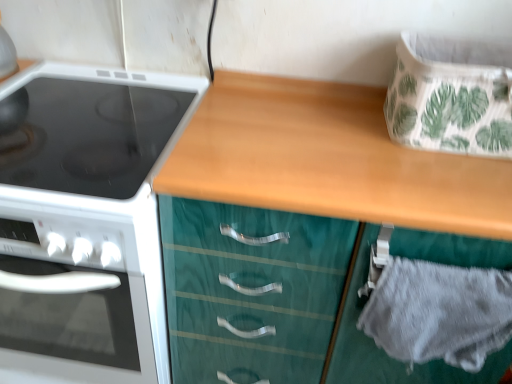
Question: From a real-world perspective, is white glossy electric stove at left on top of gray fabric drawer at lower right, the 1th cabinetry from the back?

Choices:
 (A) yes
 (B) no

Answer: (B)

Question: Is there a large distance between white glossy electric stove at left and gray fabric drawer at lower right, which ranks as the 2th cabinetry in front-to-back order?

Choices:
 (A) no
 (B) yes

Answer: (A)

Question: Can you confirm if white glossy electric stove at left is taller than gray fabric drawer at lower right, the 1th cabinetry from the back?

Choices:
 (A) no
 (B) yes

Answer: (B)

Question: Considering the relative sizes of white glossy electric stove at left and gray fabric drawer at lower right, the 1th cabinetry from the back, in the image provided, is white glossy electric stove at left thinner than gray fabric drawer at lower right, the 1th cabinetry from the back,?

Choices:
 (A) yes
 (B) no

Answer: (B)

Question: Could you tell me if white glossy electric stove at left is facing gray fabric drawer at lower right, which ranks as the 2th cabinetry in front-to-back order?

Choices:
 (A) no
 (B) yes

Answer: (A)

Question: Does white glossy electric stove at left lie in front of gray fabric drawer at lower right, the 1th cabinetry from the back?

Choices:
 (A) yes
 (B) no

Answer: (B)

Question: Does white glossy electric stove at left appear on the left side of teal wood cabinet at center, the 1th cabinetry in the front-to-back sequence?

Choices:
 (A) no
 (B) yes

Answer: (B)

Question: Is there a large distance between white glossy electric stove at left and teal wood cabinet at center, the 1th cabinetry in the front-to-back sequence?

Choices:
 (A) yes
 (B) no

Answer: (B)

Question: Is white glossy electric stove at left facing towards teal wood cabinet at center, the 1th cabinetry in the front-to-back sequence?

Choices:
 (A) yes
 (B) no

Answer: (B)

Question: Is white glossy electric stove at left facing away from teal wood cabinet at center, placed as the 2th cabinetry when sorted from back to front?

Choices:
 (A) no
 (B) yes

Answer: (A)

Question: From a real-world perspective, is white glossy electric stove at left located higher than teal wood cabinet at center, placed as the 2th cabinetry when sorted from back to front?

Choices:
 (A) yes
 (B) no

Answer: (B)

Question: Is the position of white glossy electric stove at left more distant than that of teal wood cabinet at center, placed as the 2th cabinetry when sorted from back to front?

Choices:
 (A) no
 (B) yes

Answer: (B)

Question: From a real-world perspective, does gray fabric drawer at lower right, which ranks as the 2th cabinetry in front-to-back order, sit lower than white glossy electric stove at left?

Choices:
 (A) no
 (B) yes

Answer: (A)